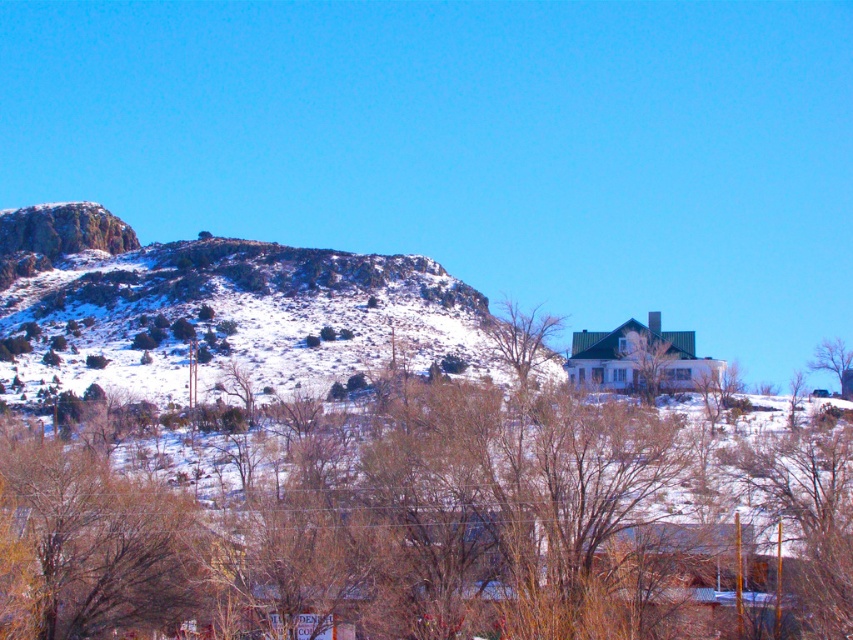
Who is positioned more to the right, green matte house at center or bare branches at upper right?

bare branches at upper right is more to the right.

Describe the element at coordinates (646, 358) in the screenshot. I see `green matte house at center` at that location.

Between point (659, 355) and point (840, 368), which one is positioned in front?

Point (659, 355)

Where is `green matte house at center`? green matte house at center is located at coordinates (646, 358).

The width and height of the screenshot is (853, 640). Find the location of `brown leafless tree at center`. brown leafless tree at center is located at coordinates (422, 524).

Where is `brown leafless tree at center`? The height and width of the screenshot is (640, 853). brown leafless tree at center is located at coordinates (422, 524).

Which of these two, brown leafless tree at center or bare branches at upper right, stands shorter?

bare branches at upper right

Can you confirm if brown leafless tree at center is taller than bare branches at upper right?

Correct, brown leafless tree at center is much taller as bare branches at upper right.

Is point (717, 573) behind point (844, 369)?

No, it is not.

This screenshot has width=853, height=640. In order to click on brown leafless tree at center in this screenshot , I will do `click(422, 524)`.